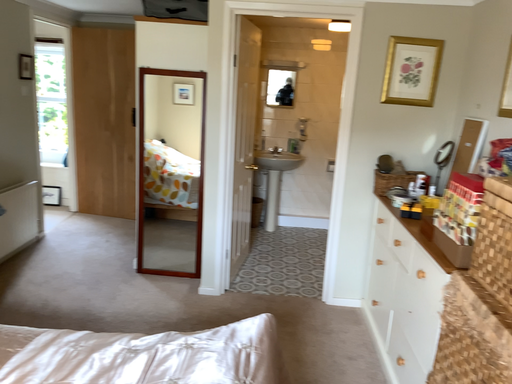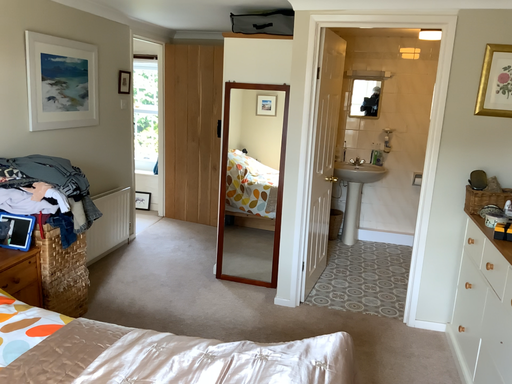
Question: Which way did the camera rotate in the video?

Choices:
 (A) rotated left
 (B) rotated right

Answer: (A)